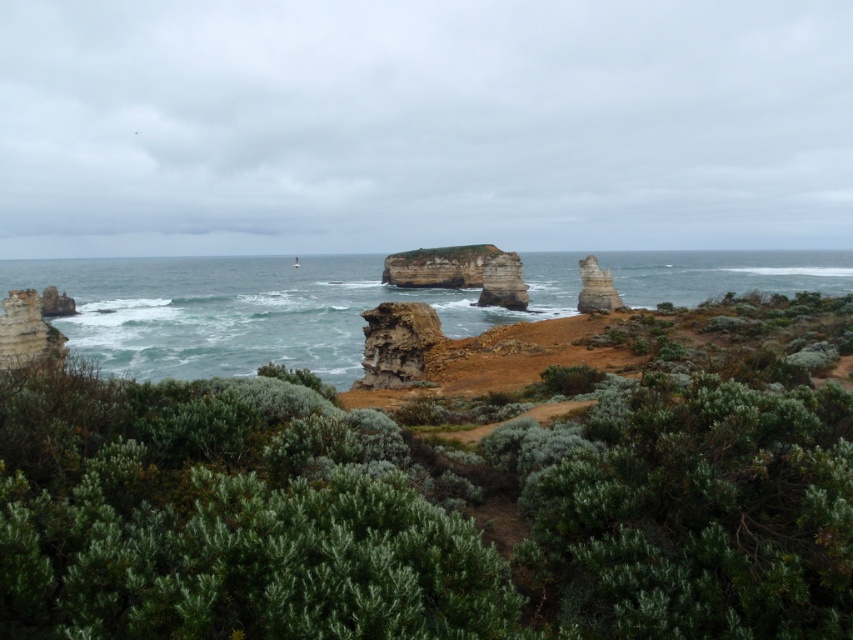
You are a hiker planning to walk from the rusty stone cliff at left to the rusty stone rock at center. Given that your average walking pace is 1.5 meters per second, how long will it take you to reach the destination?

The distance between the rusty stone cliff at left and the rusty stone rock at center is 56.43 meters. At a pace of 1.5 meters per second, the time required would be approximately 37.6 seconds.